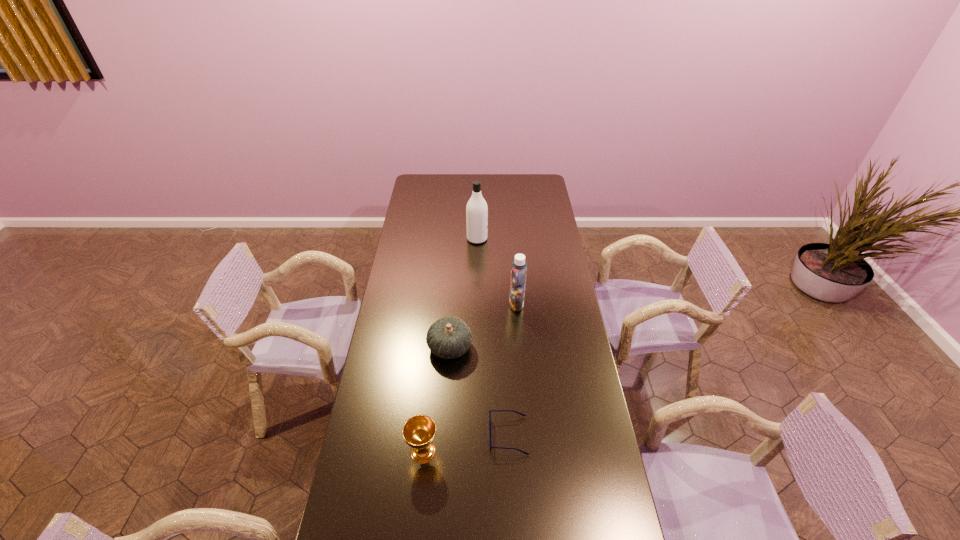
Identify which object is the fourth closest to the tallest object. Please provide its 2D coordinates. Your answer should be formatted as a tuple, i.e. [(x, y)], where the tuple contains the x and y coordinates of a point satisfying the conditions above.

[(419, 431)]

You are a GUI agent. You are given a task and a screenshot of the screen. Output one action in this format:
    pyautogui.click(x=<x>, y=<y>)
    Task: Click on the vacant region that satisfies the following two spatial constraints: 1. on the front-facing side of the spectacles; 2. on the front side of the chalice
    
    Given the screenshot: What is the action you would take?
    pyautogui.click(x=509, y=451)

Locate an element on the screen. Image resolution: width=960 pixels, height=540 pixels. vacant space that satisfies the following two spatial constraints: 1. on the front-facing side of the taller shampoo; 2. on the front side of the chalice is located at coordinates (475, 451).